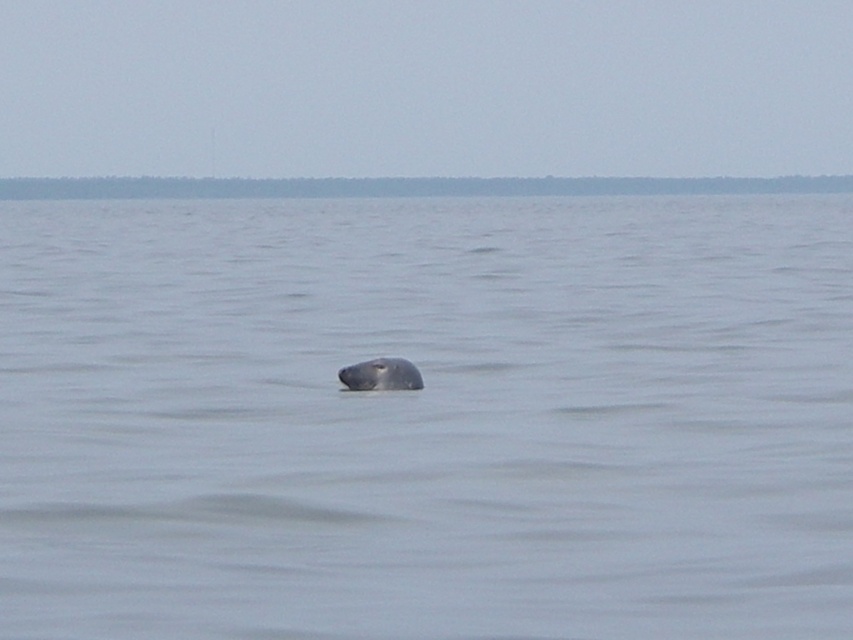
You are a photographer standing at the edge of the water, and you want to take a photo of the seal in the scene. You notice two points marked in the image. Which point is closer to your camera? The two points are point 1 at coordinates point [335,200] and point 2 at coordinates point [415,372].

Point 1 at coordinates point [335,200] is closer to the camera because it is further to the camera than point 2 at coordinates point [415,372].

You are a marine biologist observing the scene. You notice the gray matte water at center and the gray matte whale at center. Which object is positioned to the left?

The gray matte water at center is to the left of the gray matte whale at center.